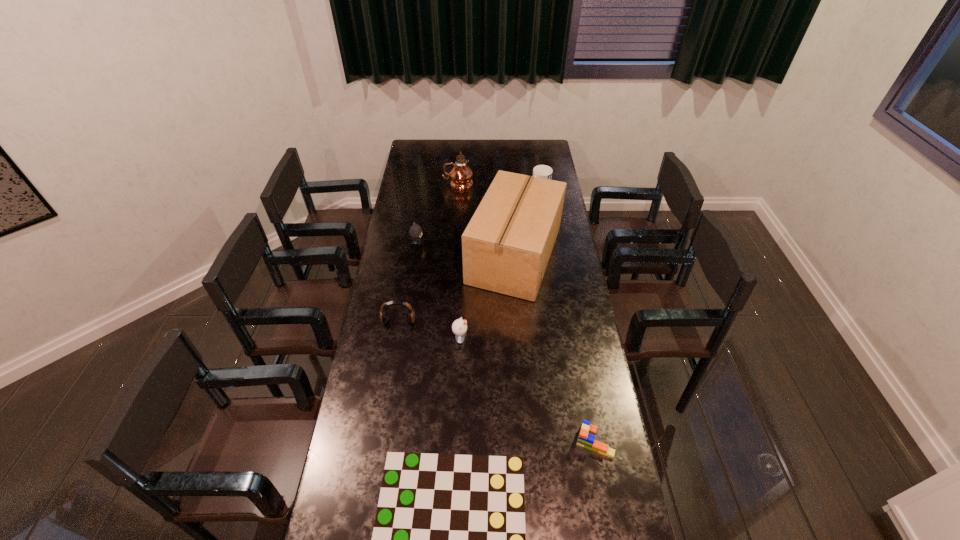
Find the location of a particular element. The height and width of the screenshot is (540, 960). oil lamp is located at coordinates (461, 175).

Where is `box`? The image size is (960, 540). box is located at coordinates (506, 247).

Find the location of `mug`. mug is located at coordinates (542, 171).

Identify the location of the fourth nearest object. The height and width of the screenshot is (540, 960). (383, 311).

At what (x,y) coordinates should I click in order to perform the action: click on the left kitten. Please return your answer as a coordinate pair (x, y). Looking at the image, I should click on (415, 231).

Locate an element on the screen. The image size is (960, 540). the third nearest object is located at coordinates (459, 327).

Where is `the right kitten`? Image resolution: width=960 pixels, height=540 pixels. the right kitten is located at coordinates (459, 327).

At what (x,y) coordinates should I click in order to perform the action: click on the second shortest object. Please return your answer as a coordinate pair (x, y). Looking at the image, I should click on (586, 438).

The width and height of the screenshot is (960, 540). I want to click on free space located 0.400m on the front of the oil lamp, so click(x=455, y=238).

Where is `free region located on the front of the box`? The width and height of the screenshot is (960, 540). free region located on the front of the box is located at coordinates (523, 367).